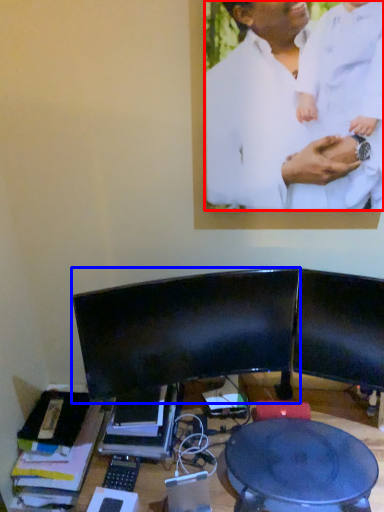
Question: Which of the following is the farthest to the observer, man (highlighted by a red box) or computer monitor (highlighted by a blue box)?

Choices:
 (A) man
 (B) computer monitor

Answer: (B)